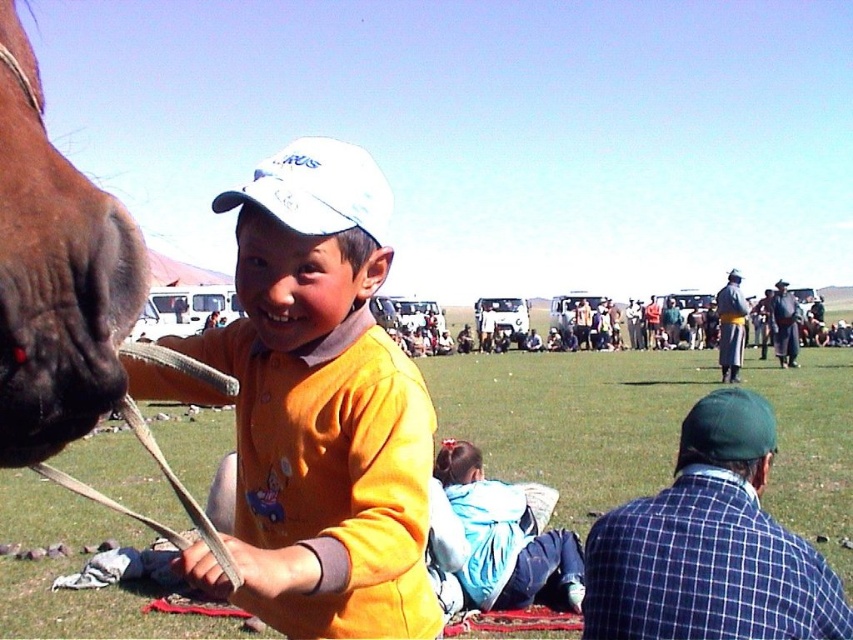
Question: Is yellow matte shirt at center above green plaid shirt at lower right?

Choices:
 (A) yes
 (B) no

Answer: (A)

Question: Does green plaid shirt at lower right have a smaller size compared to brown glossy horse at left?

Choices:
 (A) yes
 (B) no

Answer: (B)

Question: Which of these objects is positioned farthest from the brown glossy horse at left?

Choices:
 (A) yellow matte shirt at center
 (B) light blue fabric at lower center

Answer: (B)

Question: Which point is farther to the camera?

Choices:
 (A) (19, 381)
 (B) (363, 236)
 (C) (648, 566)
 (D) (527, 531)

Answer: (D)

Question: Does yellow matte shirt at center have a lesser width compared to light blue fabric at lower center?

Choices:
 (A) yes
 (B) no

Answer: (A)

Question: Which object appears closest to the camera in this image?

Choices:
 (A) green plaid shirt at lower right
 (B) light blue fabric at lower center
 (C) yellow matte shirt at center
 (D) brown glossy horse at left

Answer: (D)